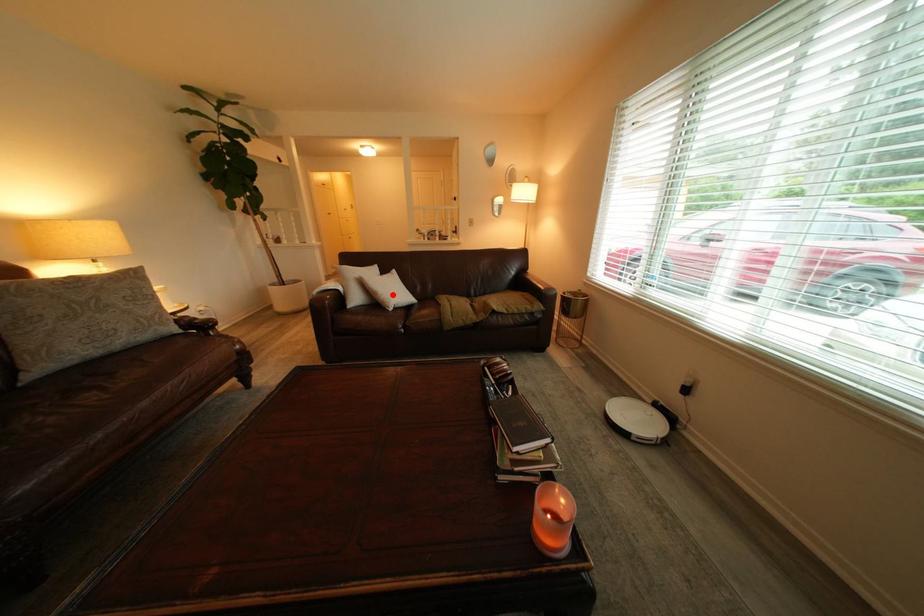
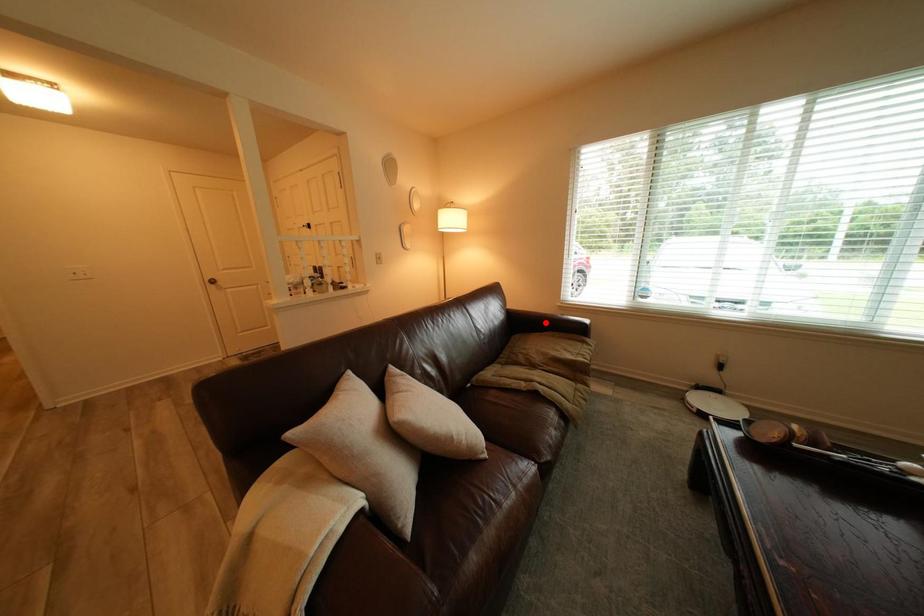
I am providing you with two images of the same scene from different viewpoints. A red point is marked on the first image and another point is marked on the second image. Do the highlighted points in image1 and image2 indicate the same real-world spot?

No